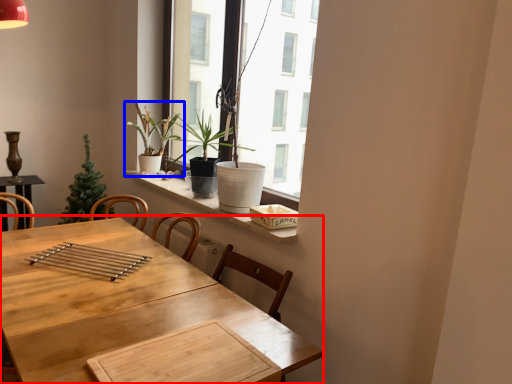
Question: Which point is further to the camera, table (highlighted by a red box) or houseplant (highlighted by a blue box)?

Choices:
 (A) table
 (B) houseplant

Answer: (B)